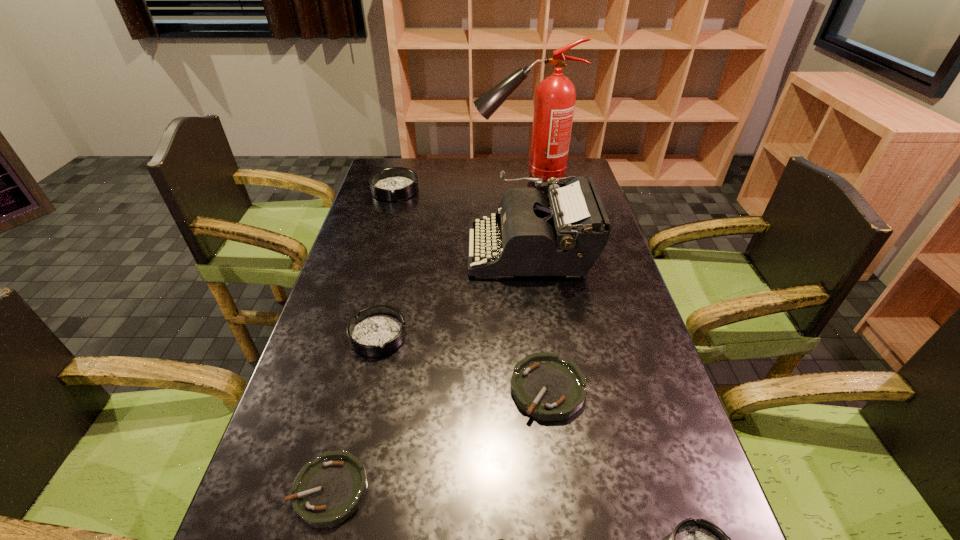
Where is `ashtray object that ranks as the sixth closest to the typewriter`? ashtray object that ranks as the sixth closest to the typewriter is located at coordinates (498, 539).

Where is `ashtray that is the third closest to the farthest dark ashtray`? This screenshot has width=960, height=540. ashtray that is the third closest to the farthest dark ashtray is located at coordinates (328, 490).

Identify which dark ashtray is the nearest to the leftmost green ashtray. Please provide its 2D coordinates. Your answer should be formatted as a tuple, i.e. [(x, y)], where the tuple contains the x and y coordinates of a point satisfying the conditions above.

[(378, 330)]

The height and width of the screenshot is (540, 960). In order to click on the second closest dark ashtray relative to the third tallest object in this screenshot , I will do `click(693, 539)`.

The image size is (960, 540). Find the location of `green ashtray that is the nearest to the second nearest green ashtray`. green ashtray that is the nearest to the second nearest green ashtray is located at coordinates (498, 539).

Locate which green ashtray ranks second in proximity to the second tallest object. Please provide its 2D coordinates. Your answer should be formatted as a tuple, i.e. [(x, y)], where the tuple contains the x and y coordinates of a point satisfying the conditions above.

[(328, 490)]

You are a GUI agent. You are given a task and a screenshot of the screen. Output one action in this format:
    pyautogui.click(x=<x>, y=<y>)
    Task: Click on the vacant space that satisfies the following two spatial constraints: 1. on the back side of the fourth nearest object; 2. on the right side of the leftmost green ashtray
    The image size is (960, 540).
    Given the screenshot: What is the action you would take?
    pyautogui.click(x=355, y=388)

Where is `free space that satisfies the following two spatial constraints: 1. at the nozzle end of the red fire extinguisher; 2. on the front side of the third farthest ashtray`? Image resolution: width=960 pixels, height=540 pixels. free space that satisfies the following two spatial constraints: 1. at the nozzle end of the red fire extinguisher; 2. on the front side of the third farthest ashtray is located at coordinates click(557, 388).

The height and width of the screenshot is (540, 960). In order to click on vacant point that satisfies the following two spatial constraints: 1. at the nozzle end of the fire extinguisher; 2. on the front side of the biggest dark ashtray in this screenshot , I will do `click(526, 190)`.